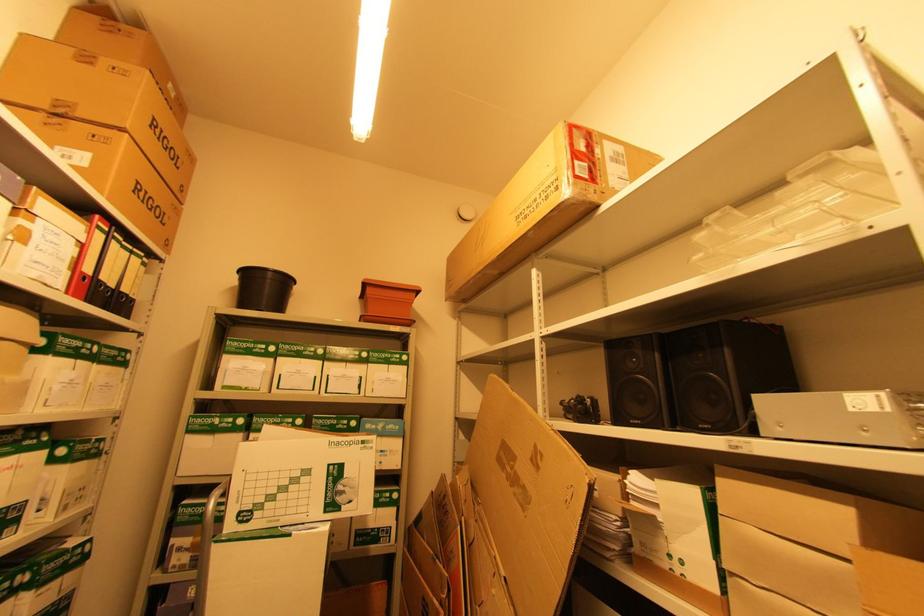
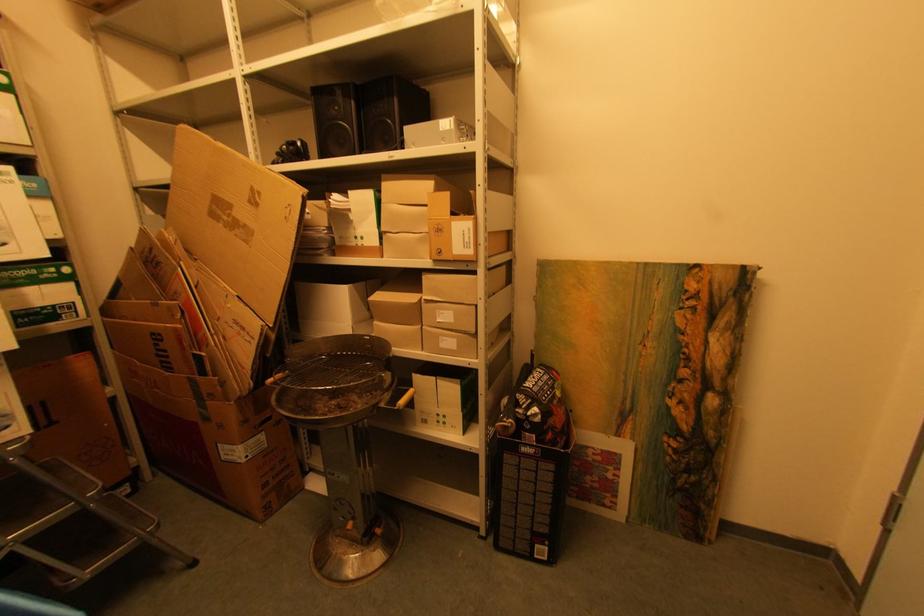
First-person continuous shooting, in which direction is the camera rotating?

The rotation direction of the camera is right-down.